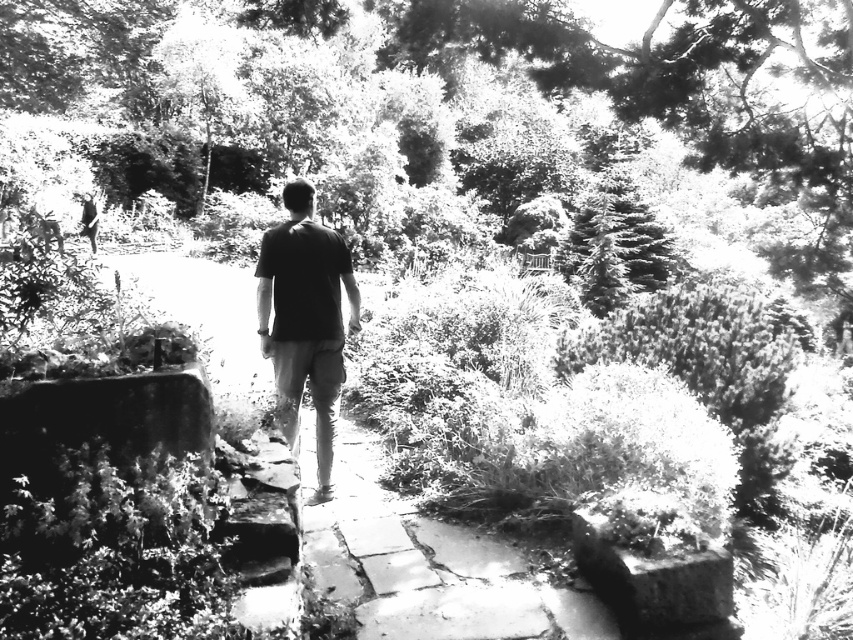
Question: Considering the real-world distances, which object is farthest from the smooth green pine tree at upper right?

Choices:
 (A) black matte shirt at center
 (B) smooth stone pavement at center

Answer: (B)

Question: Which object is positioned closest to the smooth stone pavement at center?

Choices:
 (A) smooth green pine tree at upper right
 (B) black matte shirt at center

Answer: (B)

Question: Does black matte shirt at center come in front of smooth green pine tree at upper right?

Choices:
 (A) yes
 (B) no

Answer: (A)

Question: Is smooth stone pavement at center above smooth green pine tree at upper right?

Choices:
 (A) yes
 (B) no

Answer: (B)

Question: Which point is farther to the camera?

Choices:
 (A) smooth green pine tree at upper right
 (B) smooth stone pavement at center

Answer: (A)

Question: Is smooth stone pavement at center to the right of black matte shirt at center from the viewer's perspective?

Choices:
 (A) yes
 (B) no

Answer: (A)